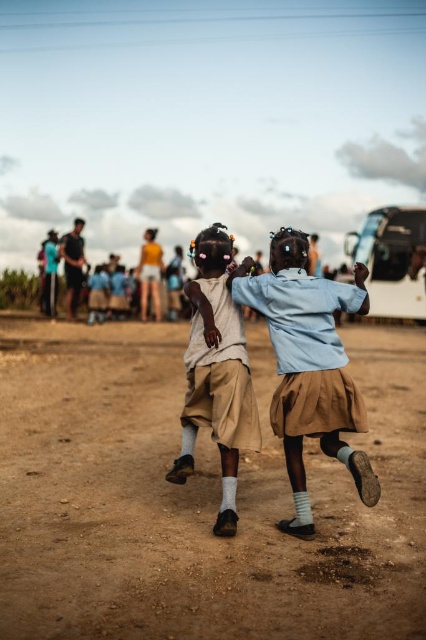
You are a photographer trying to capture the children in the scene. You notice the brown sandy ground at center and the light brown cotton shorts at center. Which object is located below the other?

The brown sandy ground at center is positioned under light brown cotton shorts at center, so the sandy ground is below the shorts.

You are standing at the origin point of the image coordinate system. You want to walk to the point at (x=233, y=467). However, there is an obstacle at point (x=169, y=406). Will you pass by the obstacle before reaching your destination?

Point (x=169, y=406) is behind point (x=233, y=467), so you will reach your destination at (x=233, y=467) before encountering the obstacle at (x=169, y=406).